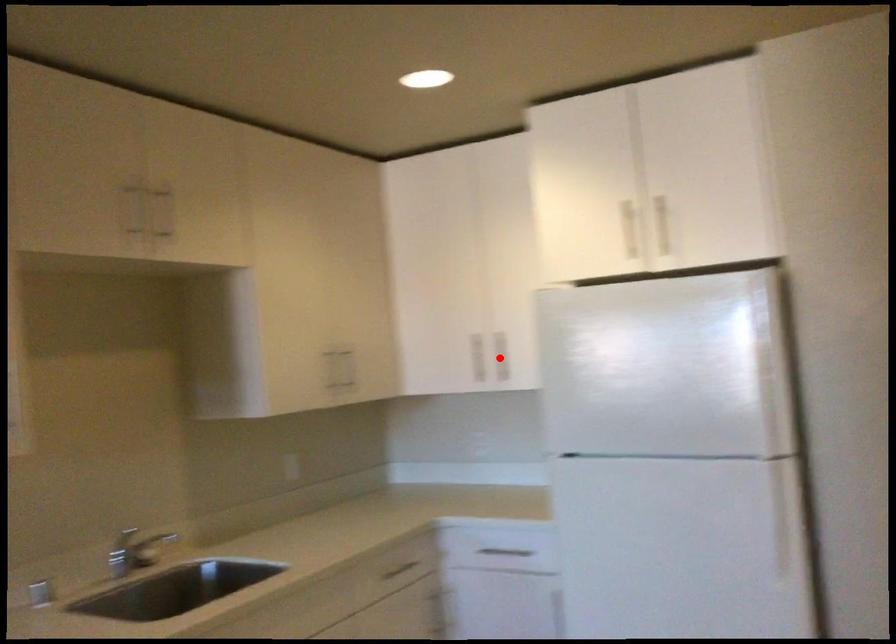
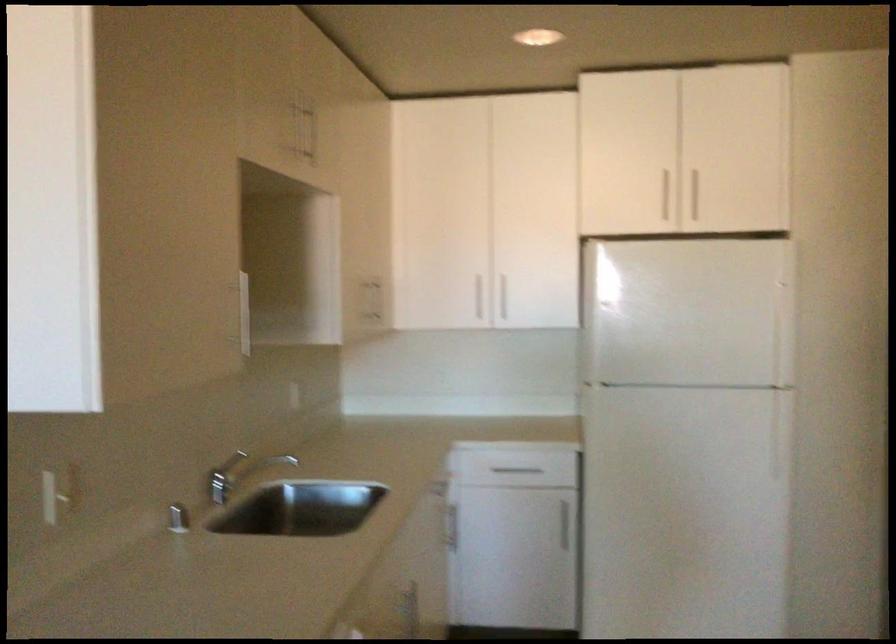
Where in the second image is the point corresponding to the highlighted location from the first image?

(506, 298)